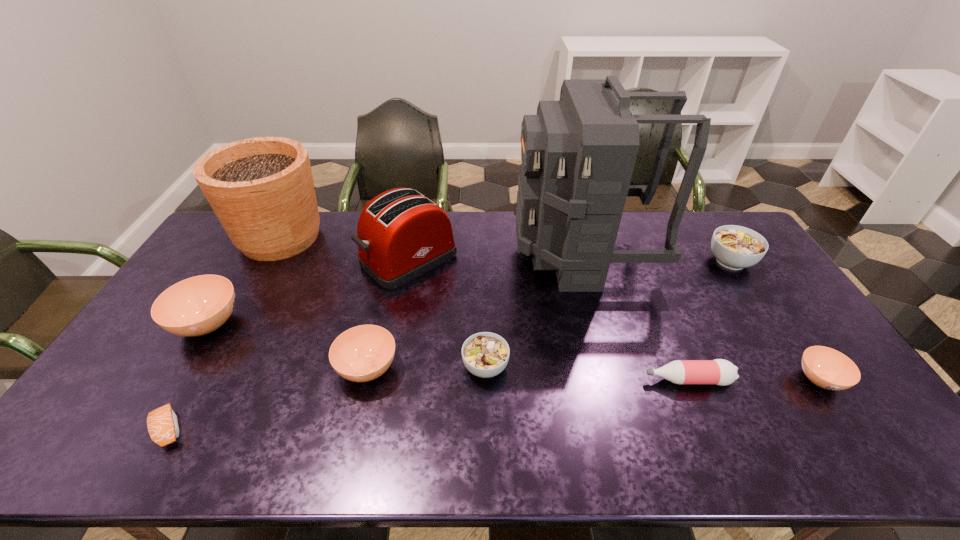
Find the location of a particular element. free spot between the tallest object and the pink bottle is located at coordinates (635, 316).

You are a GUI agent. You are given a task and a screenshot of the screen. Output one action in this format:
    pyautogui.click(x=<x>, y=<y>)
    Task: Click on the free space between the fifth object from right to left and the red toaster
    
    Given the screenshot: What is the action you would take?
    pyautogui.click(x=447, y=313)

Image resolution: width=960 pixels, height=540 pixels. In order to click on unoccupied area between the flowerpot and the farther white soup bowl in this screenshot , I will do `click(505, 249)`.

Point out which object is positioned as the second nearest to the backpack. Please provide its 2D coordinates. Your answer should be formatted as a tuple, i.e. [(x, y)], where the tuple contains the x and y coordinates of a point satisfying the conditions above.

[(401, 234)]

The width and height of the screenshot is (960, 540). Identify the location of object that is the fifth nearest to the second peach soup bowl from left to right. coord(261,189).

Find the location of a particular element. This screenshot has width=960, height=540. soup bowl object that ranks as the fourth closest to the fourth soup bowl from right to left is located at coordinates (827, 368).

Where is `soup bowl that is the fourth closest to the biggest peach soup bowl`? soup bowl that is the fourth closest to the biggest peach soup bowl is located at coordinates (827, 368).

Point out which peach soup bowl is positioned as the third nearest to the third tallest object. Please provide its 2D coordinates. Your answer should be formatted as a tuple, i.e. [(x, y)], where the tuple contains the x and y coordinates of a point satisfying the conditions above.

[(827, 368)]

Identify the location of peach soup bowl object that ranks as the third closest to the farthest soup bowl. The height and width of the screenshot is (540, 960). (199, 305).

Identify the location of vacant region that satisfies the following two spatial constraints: 1. on the front side of the ninth shortest object; 2. on the left side of the right white soup bowl. (267, 261).